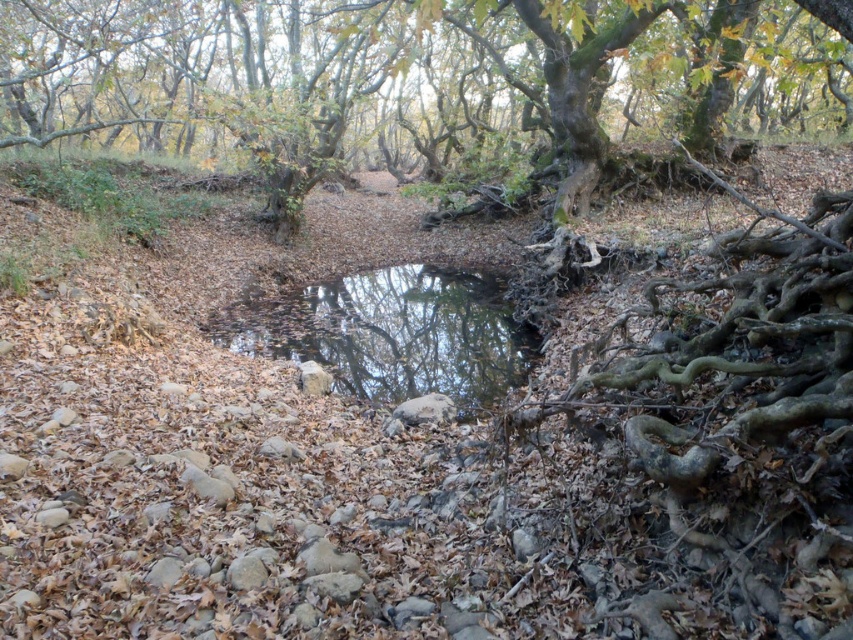
Is green mossy tree at center taller than clear water at center?

Yes, green mossy tree at center is taller than clear water at center.

Is green mossy tree at center below clear water at center?

No.

This screenshot has height=640, width=853. What do you see at coordinates (426, 88) in the screenshot?
I see `green mossy tree at center` at bounding box center [426, 88].

Locate an element on the screen. Image resolution: width=853 pixels, height=640 pixels. green mossy tree at center is located at coordinates (426, 88).